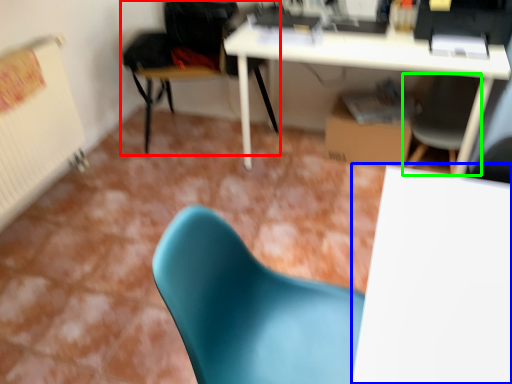
Question: Which object is the farthest from chair (highlighted by a red box)? Choose among these: table (highlighted by a blue box) or chair (highlighted by a green box).

Choices:
 (A) table
 (B) chair

Answer: (A)